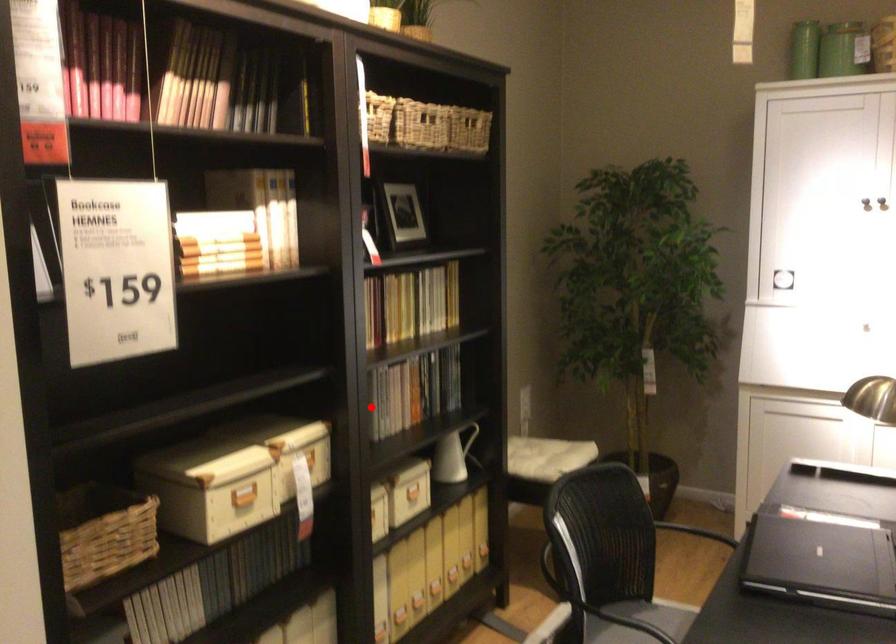
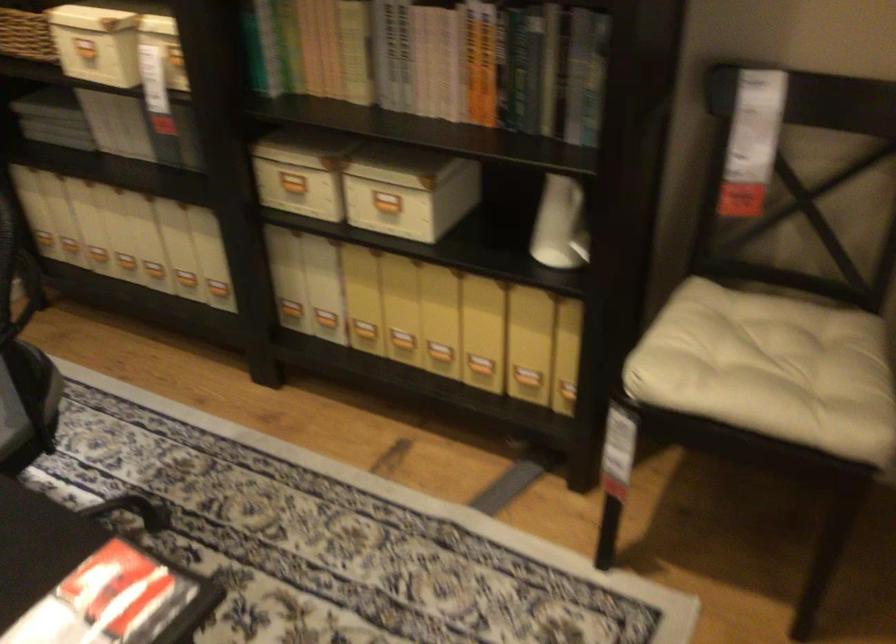
Question: I am providing you with two images of the same scene from different viewpoints. In image1, a red point is highlighted. Considering the same 3D point in image2, which of the following is correct?

Choices:
 (A) It is closer
 (B) It is farther

Answer: (A)